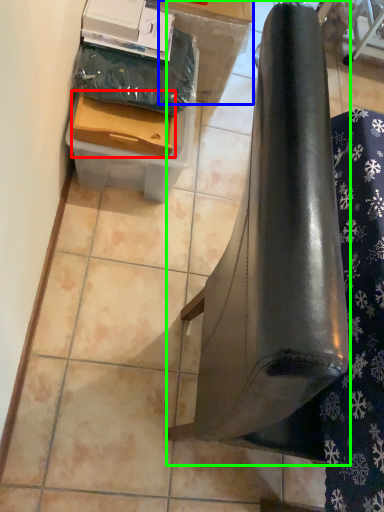
Question: Which object is positioned farthest from drawer (highlighted by a red box)? Select from cardboard box (highlighted by a blue box) and furniture (highlighted by a green box).

Choices:
 (A) cardboard box
 (B) furniture

Answer: (B)